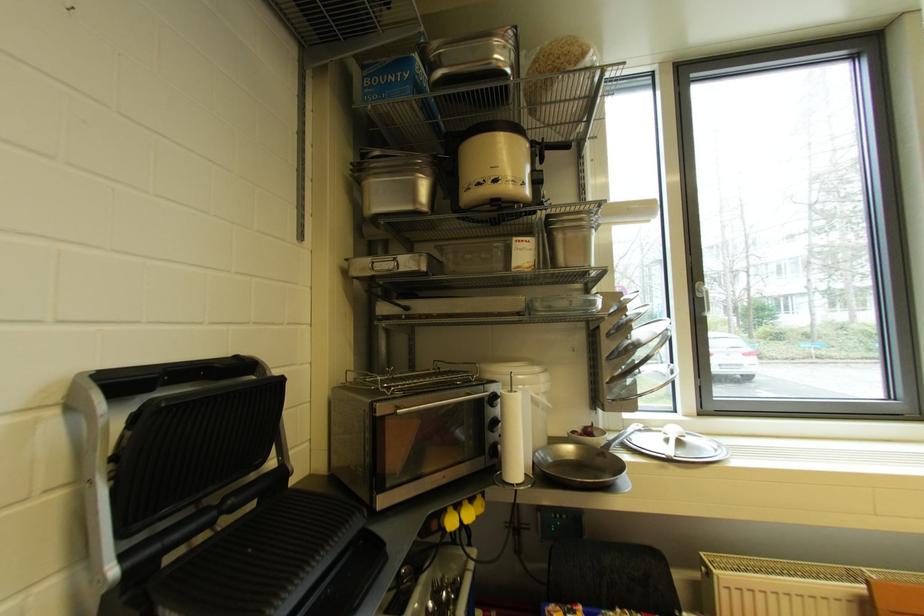
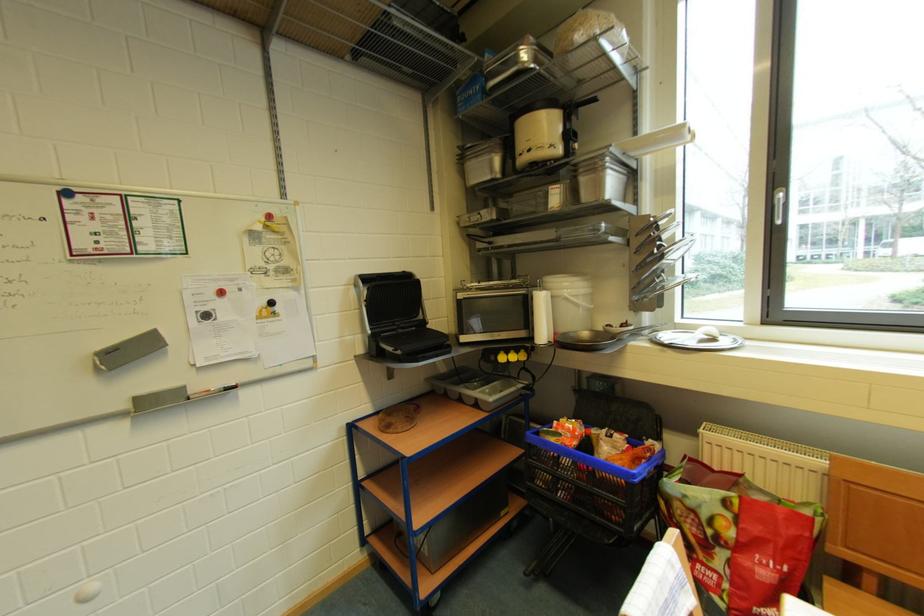
Find the pixel in the second image that matches point (442, 528) in the first image.

(500, 361)